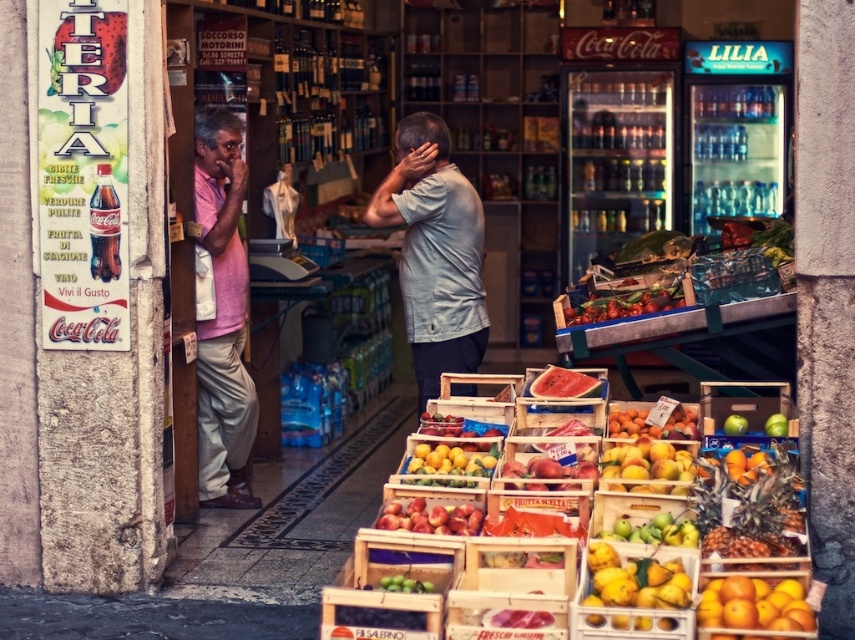
What do you see at coordinates (434, 252) in the screenshot? Image resolution: width=855 pixels, height=640 pixels. I see `gray cotton shirt at center` at bounding box center [434, 252].

Is gray cotton shirt at center above green matte pears at center?

Correct, gray cotton shirt at center is located above green matte pears at center.

Who is more distant from viewer, (420,285) or (670,515)?

The point (420,285) is behind.

This screenshot has height=640, width=855. In order to click on gray cotton shirt at center in this screenshot , I will do `click(434, 252)`.

Does pink cotton shirt at left appear on the right side of orange matte fruit at lower right?

No, pink cotton shirt at left is not to the right of orange matte fruit at lower right.

Is pink cotton shirt at left smaller than orange matte fruit at lower right?

No.

Find the location of a particular element. The width and height of the screenshot is (855, 640). pink cotton shirt at left is located at coordinates (222, 316).

Does yellow matte pears at center appear on the right side of smooth pink watermelon at center?

Indeed, yellow matte pears at center is positioned on the right side of smooth pink watermelon at center.

Image resolution: width=855 pixels, height=640 pixels. I want to click on yellow matte pears at center, so click(635, 595).